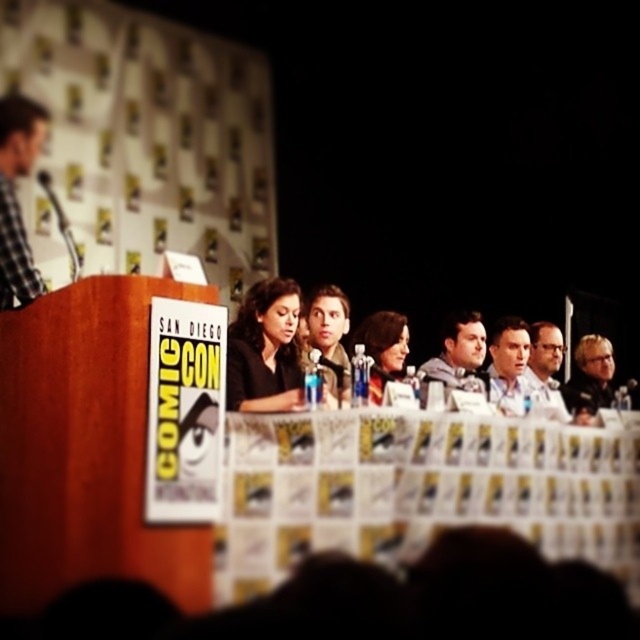
You are a photographer at the panel discussion. You need to capture a photo that includes both the white paper at center and the checkered fabric shirt at left. Which object should be placed closer to the camera to ensure both fit in the frame?

The white paper at center is wider than the checkered fabric shirt at left. To ensure both fit in the frame, position the wider object, the white paper at center, closer to the camera. This adjustment will help balance their sizes in the photo.